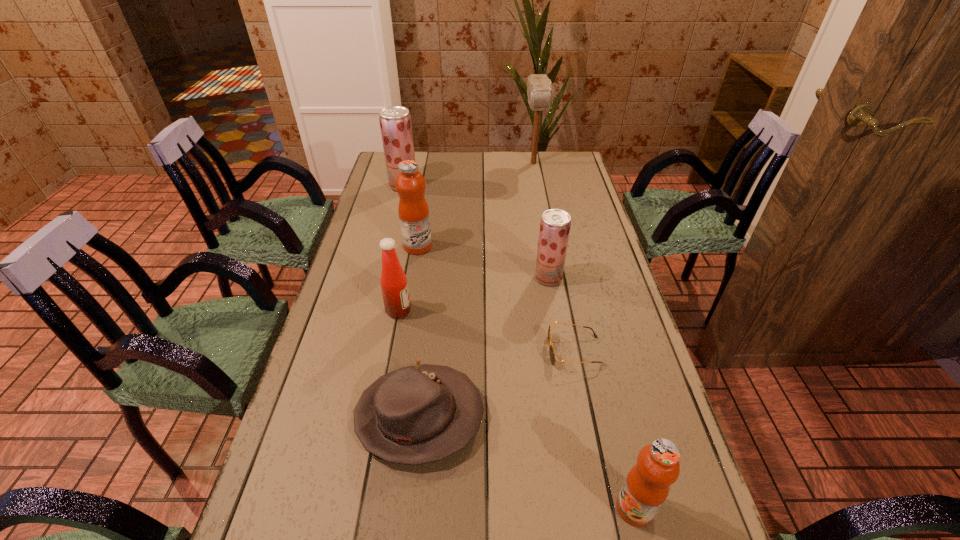
At what (x,y) coordinates should I click in order to perform the action: click on the farthest object. Please return your answer as a coordinate pair (x, y). Looking at the image, I should click on (539, 87).

Find the location of a particular element. Image resolution: width=960 pixels, height=540 pixels. the second farthest object is located at coordinates (395, 121).

Locate an element on the screen. The width and height of the screenshot is (960, 540). the farthest fruit juice is located at coordinates (395, 121).

Locate an element on the screen. The image size is (960, 540). the third nearest fruit juice is located at coordinates (413, 210).

You are a GUI agent. You are given a task and a screenshot of the screen. Output one action in this format:
    pyautogui.click(x=<x>, y=<y>)
    Task: Click on the sixth nearest object
    The image size is (960, 540).
    Given the screenshot: What is the action you would take?
    pyautogui.click(x=413, y=210)

This screenshot has width=960, height=540. Find the location of `the fourth nearest object`. the fourth nearest object is located at coordinates [393, 280].

You are a GUI agent. You are given a task and a screenshot of the screen. Output one action in this format:
    pyautogui.click(x=<x>, y=<y>)
    Task: Click on the red condiment
    The height and width of the screenshot is (540, 960).
    Given the screenshot: What is the action you would take?
    pyautogui.click(x=393, y=280)

Find the location of a particular element. The image size is (960, 540). the right strawberry fruit juice is located at coordinates click(x=555, y=224).

The height and width of the screenshot is (540, 960). Identify the location of the third farthest fruit juice. (555, 224).

This screenshot has height=540, width=960. In order to click on the right orange fruit juice in this screenshot , I will do `click(646, 487)`.